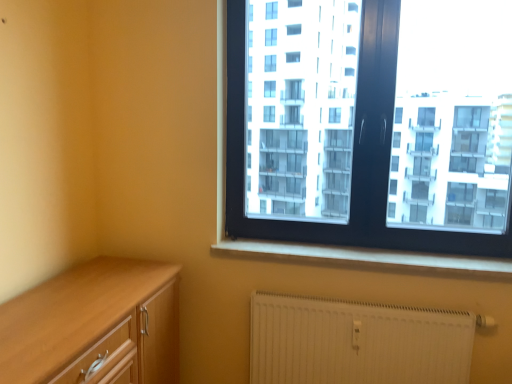
Question: From the image's perspective, is white smooth window sill at lower center above black plastic window at upper right?

Choices:
 (A) no
 (B) yes

Answer: (A)

Question: Does white smooth window sill at lower center appear on the left side of black plastic window at upper right?

Choices:
 (A) no
 (B) yes

Answer: (B)

Question: From a real-world perspective, is white smooth window sill at lower center positioned over black plastic window at upper right based on gravity?

Choices:
 (A) yes
 (B) no

Answer: (B)

Question: Is white smooth window sill at lower center surrounding black plastic window at upper right?

Choices:
 (A) yes
 (B) no

Answer: (B)

Question: From a real-world perspective, is white smooth window sill at lower center below black plastic window at upper right?

Choices:
 (A) no
 (B) yes

Answer: (B)

Question: Is the depth of white smooth window sill at lower center greater than that of black plastic window at upper right?

Choices:
 (A) no
 (B) yes

Answer: (B)

Question: Is white textured radiator at lower right inside white smooth window sill at lower center?

Choices:
 (A) yes
 (B) no

Answer: (B)

Question: Is white smooth window sill at lower center positioned far away from white textured radiator at lower right?

Choices:
 (A) yes
 (B) no

Answer: (B)

Question: Can you confirm if white smooth window sill at lower center is shorter than white textured radiator at lower right?

Choices:
 (A) no
 (B) yes

Answer: (B)

Question: From a real-world perspective, is white smooth window sill at lower center located beneath white textured radiator at lower right?

Choices:
 (A) yes
 (B) no

Answer: (B)

Question: Is white smooth window sill at lower center oriented away from white textured radiator at lower right?

Choices:
 (A) yes
 (B) no

Answer: (B)

Question: From a real-world perspective, is white smooth window sill at lower center located higher than white textured radiator at lower right?

Choices:
 (A) no
 (B) yes

Answer: (B)

Question: Is white textured radiator at lower right next to white smooth window sill at lower center?

Choices:
 (A) yes
 (B) no

Answer: (B)